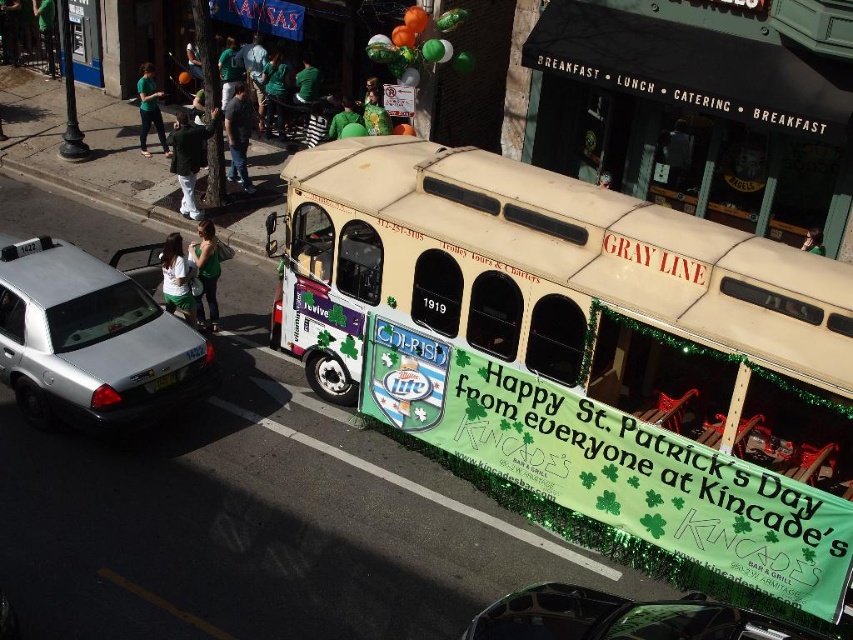
Question: Can you confirm if green fabric shirt at lower left is smaller than green matte shirt at center?

Choices:
 (A) yes
 (B) no

Answer: (A)

Question: Which point is farther from the camera taking this photo?

Choices:
 (A) (780, 630)
 (B) (328, 131)
 (C) (180, 296)
 (D) (235, 144)

Answer: (B)

Question: Estimate the real-world distances between objects in this image. Which object is farther from the shiny black car at center?

Choices:
 (A) green matte shirt at center
 (B) green fabric shirt at upper left

Answer: (B)

Question: Which of the following is the farthest from the observer?

Choices:
 (A) shiny black car at center
 (B) beige fabric-covered bus at center

Answer: (B)

Question: Is green fabric shirt at lower left below green fabric sign at center?

Choices:
 (A) yes
 (B) no

Answer: (A)

Question: Can you confirm if denim jeans at center is bigger than matte black face at center?

Choices:
 (A) yes
 (B) no

Answer: (A)